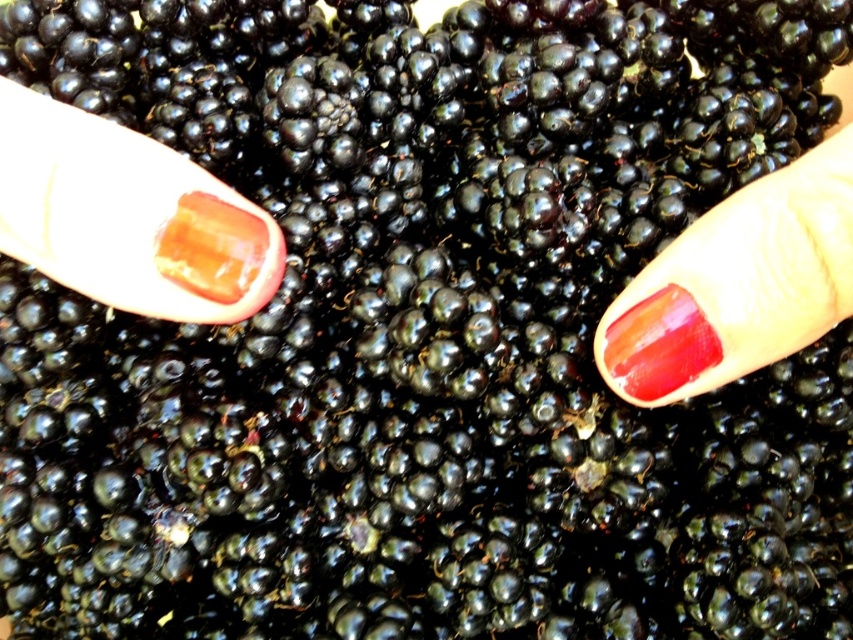
Question: Considering the relative positions of glossy acrylic nail at upper left and translucent amber cube at center in the image provided, where is glossy acrylic nail at upper left located with respect to translucent amber cube at center?

Choices:
 (A) above
 (B) below

Answer: (A)

Question: Which of the following is the closest to the observer?

Choices:
 (A) translucent amber cube at center
 (B) red glossy nail at center
 (C) glossy acrylic nail at upper left
 (D) glossy red nail polish at center

Answer: (B)

Question: Which object is the closest to the glossy acrylic nail at upper left?

Choices:
 (A) red glossy nail at center
 (B) glossy red nail polish at center

Answer: (B)

Question: Does glossy acrylic nail at upper left appear on the left side of translucent amber cube at center?

Choices:
 (A) yes
 (B) no

Answer: (A)

Question: Considering the relative positions of red glossy nail at center and glossy red nail polish at center in the image provided, where is red glossy nail at center located with respect to glossy red nail polish at center?

Choices:
 (A) left
 (B) right

Answer: (B)

Question: Which point appears closest to the camera in this image?

Choices:
 (A) (173, 176)
 (B) (183, 259)
 (C) (737, 198)

Answer: (A)